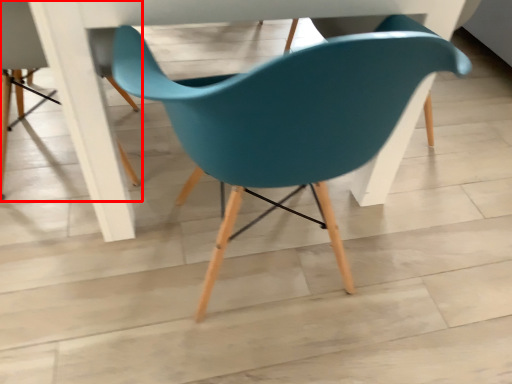
Question: From the image's perspective, considering the relative positions of chair (annotated by the red box) and chair in the image provided, where is chair (annotated by the red box) located with respect to the staircase?

Choices:
 (A) above
 (B) below

Answer: (A)